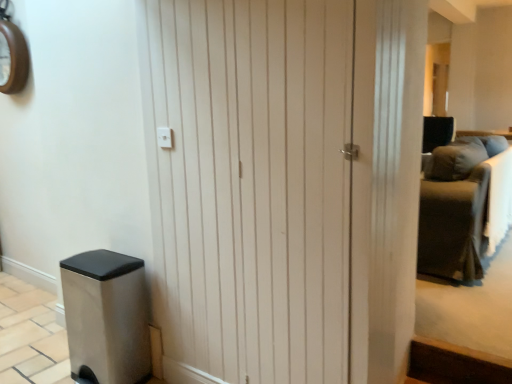
I want to click on wooden clock at upper left, so click(x=12, y=54).

Describe the element at coordinates (249, 186) in the screenshot. I see `white wood door at center` at that location.

Find the location of a particular element. The height and width of the screenshot is (384, 512). dark gray fabric couch at right is located at coordinates (464, 214).

In order to click on wooden clock at upper left in this screenshot , I will do `click(12, 54)`.

Can you confirm if dark gray fabric couch at right is shorter than wooden clock at upper left?

No, dark gray fabric couch at right is not shorter than wooden clock at upper left.

From the image's perspective, who appears lower, dark gray fabric couch at right or wooden clock at upper left?

dark gray fabric couch at right appears lower in the image.

Where is `furniture below the wooden clock at upper left (from the image's perspective)`? This screenshot has height=384, width=512. furniture below the wooden clock at upper left (from the image's perspective) is located at coordinates (464, 214).

What's the angular difference between dark gray fabric couch at right and wooden clock at upper left's facing directions?

The angle between the facing direction of dark gray fabric couch at right and the facing direction of wooden clock at upper left is 92.3 degrees.

Considering the relative sizes of dark gray fabric couch at right and white wood door at center in the image provided, is dark gray fabric couch at right taller than white wood door at center?

No.

Which object is closer to the camera, dark gray fabric couch at right or white wood door at center?

white wood door at center.

Can you confirm if dark gray fabric couch at right is bigger than white wood door at center?

Yes.

Is dark gray fabric couch at right thinner than white wood door at center?

In fact, dark gray fabric couch at right might be wider than white wood door at center.

Is wooden clock at upper left facing away from white wood door at center?

No, wooden clock at upper left is not facing away from white wood door at center.

From the image's perspective, who appears lower, wooden clock at upper left or white wood door at center?

white wood door at center.

Considering the relative positions of white wood door at center and dark gray fabric couch at right in the image provided, is white wood door at center to the left of dark gray fabric couch at right from the viewer's perspective?

Yes.

Is white wood door at center directly adjacent to dark gray fabric couch at right?

There is a gap between white wood door at center and dark gray fabric couch at right.

From the picture: From a real-world perspective, relative to dark gray fabric couch at right, is white wood door at center vertically above or below?

white wood door at center is situated higher than dark gray fabric couch at right in the real world.

Between point (206, 157) and point (426, 237), which one is positioned behind?

The point (426, 237) is behind.

Is white wood door at center taller than wooden clock at upper left?

Yes.

I want to click on barn door beneath the wooden clock at upper left (from a real-world perspective), so click(x=249, y=186).

Which object is further away from the camera, white wood door at center or wooden clock at upper left?

wooden clock at upper left is more distant.

Would you say wooden clock at upper left is to the left or to the right of dark gray fabric couch at right in the picture?

From the image, it's evident that wooden clock at upper left is to the left of dark gray fabric couch at right.

Is point (17, 72) closer or farther from the camera than point (425, 182)?

Point (17, 72) appears to be farther away from the viewer than point (425, 182).

Does wooden clock at upper left have a greater width compared to dark gray fabric couch at right?

Incorrect, the width of wooden clock at upper left does not surpass that of dark gray fabric couch at right.

Is wooden clock at upper left inside the boundaries of dark gray fabric couch at right, or outside?

The correct answer is: outside.

This screenshot has width=512, height=384. Identify the location of clock above the dark gray fabric couch at right (from a real-world perspective). (12, 54).

I want to click on furniture on the right of white wood door at center, so click(464, 214).

When comparing their distances from white wood door at center, does wooden clock at upper left or dark gray fabric couch at right seem closer?

Based on the image, dark gray fabric couch at right appears to be nearer to white wood door at center.

Estimate the real-world distances between objects in this image. Which object is closer to dark gray fabric couch at right, white wood door at center or wooden clock at upper left?

Based on the image, white wood door at center appears to be nearer to dark gray fabric couch at right.

From the image, which object appears to be nearer to wooden clock at upper left, white wood door at center or dark gray fabric couch at right?

white wood door at center is closer to wooden clock at upper left.

Based on their spatial positions, is dark gray fabric couch at right or white wood door at center further from wooden clock at upper left?

Among the two, dark gray fabric couch at right is located further to wooden clock at upper left.

Which object lies further to the anchor point dark gray fabric couch at right, wooden clock at upper left or white wood door at center?

wooden clock at upper left is positioned further to the anchor dark gray fabric couch at right.

When comparing their distances from white wood door at center, does dark gray fabric couch at right or wooden clock at upper left seem further?

The object further to white wood door at center is wooden clock at upper left.

The image size is (512, 384). In order to click on barn door between wooden clock at upper left and dark gray fabric couch at right from left to right in this screenshot , I will do `click(249, 186)`.